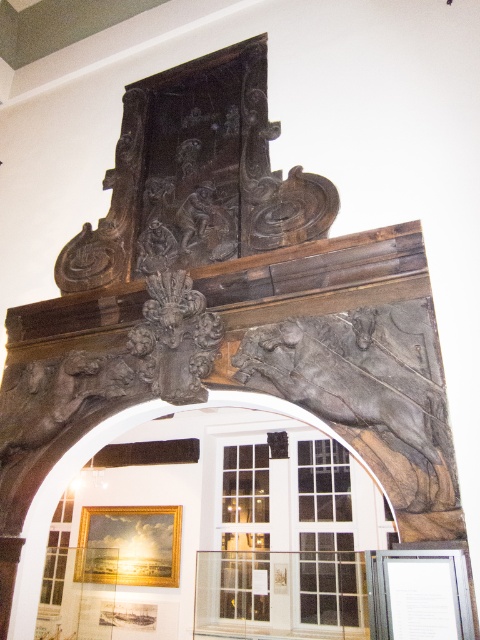
Does dark gray stone horse at center appear on the left side of dark stone archway at center?

In fact, dark gray stone horse at center is to the right of dark stone archway at center.

Is dark gray stone horse at center taller than dark stone archway at center?

Incorrect, dark gray stone horse at center's height is not larger of dark stone archway at center's.

The height and width of the screenshot is (640, 480). Find the location of `dark gray stone horse at center`. dark gray stone horse at center is located at coordinates click(x=365, y=388).

Image resolution: width=480 pixels, height=640 pixels. Find the location of `dark gray stone horse at center`. dark gray stone horse at center is located at coordinates (365, 388).